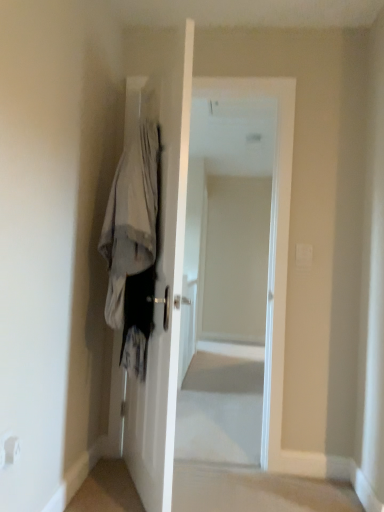
In order to click on unoccupied region to the right of white glossy door at center in this screenshot , I will do `click(231, 488)`.